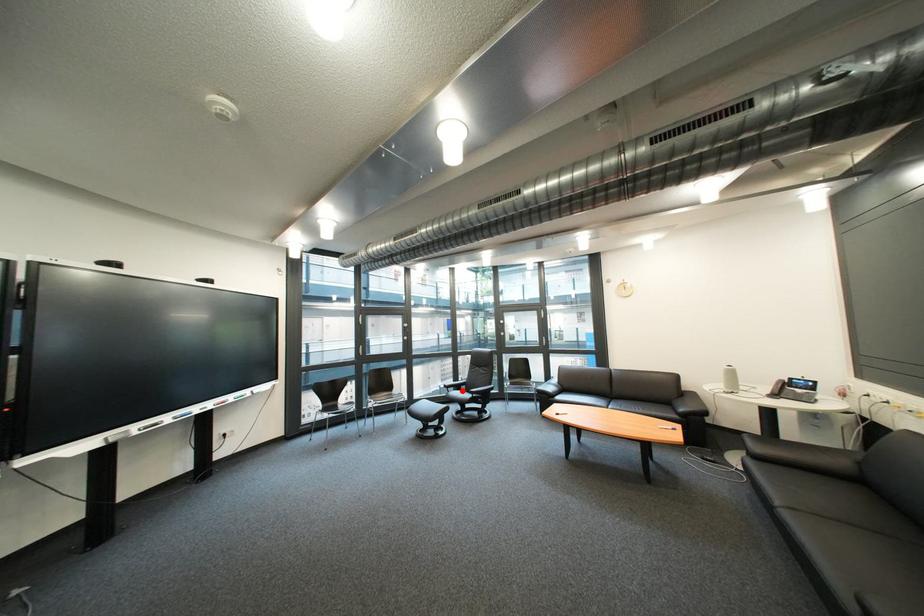
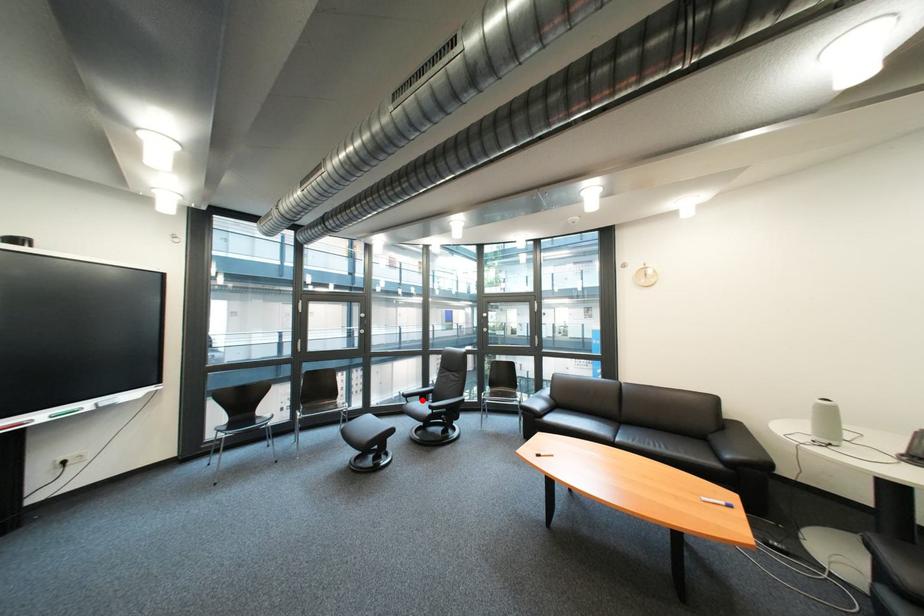
I am providing you with two images of the same scene from different viewpoints. A red point is marked on the first image and another point is marked on the second image. Is the marked point in image1 the same physical position as the marked point in image2?

Yes